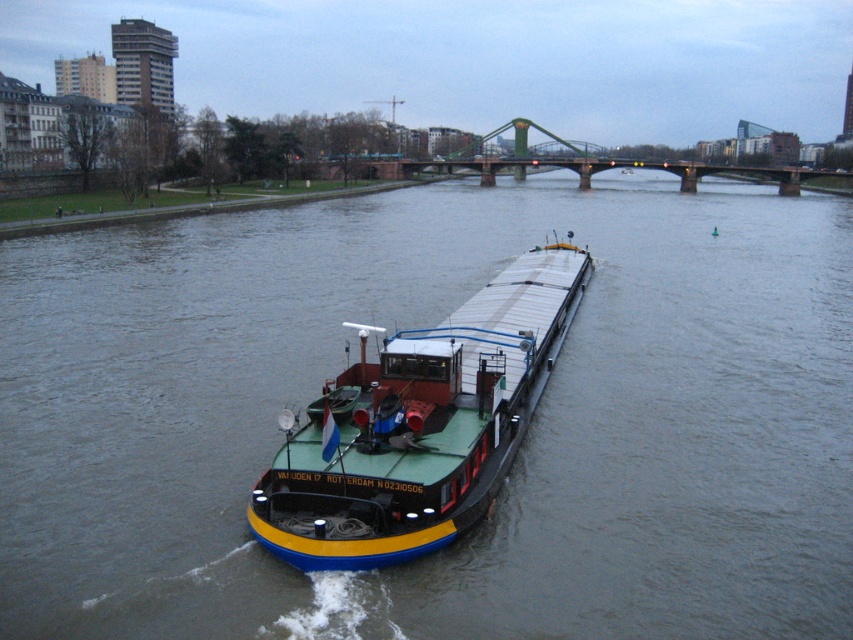
You are standing on the riverbank and see the smooth gray water at center and the blue painted steel barge at center. Which object is closer to you?

The smooth gray water at center is closer to the viewer than the blue painted steel barge at center.

Looking at this image, you are a boat operator trying to navigate a narrow channel. You see the smooth gray water at center and the blue painted steel barge at center in the river. Which one has a greater width?

The smooth gray water at center has a greater width than the blue painted steel barge at center.